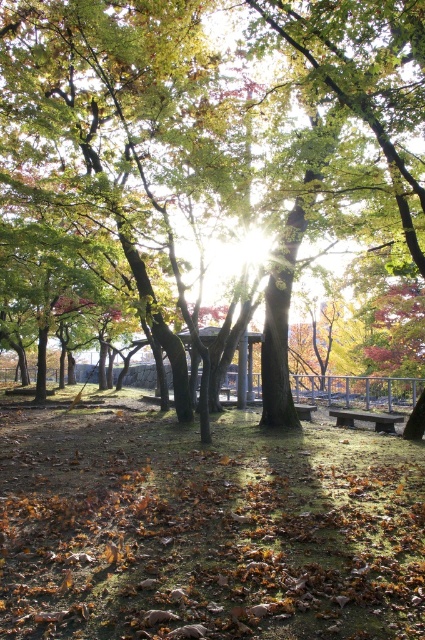
Question: Can you confirm if rustic wood bench at center is positioned to the right of wooden park bench at center?

Choices:
 (A) no
 (B) yes

Answer: (B)

Question: Which point is closer to the camera?

Choices:
 (A) (384, 422)
 (B) (302, 412)

Answer: (A)

Question: Is rustic wood bench at center further to camera compared to wooden park bench at center?

Choices:
 (A) yes
 (B) no

Answer: (A)

Question: Which point is closer to the camera taking this photo?

Choices:
 (A) (306, 404)
 (B) (339, 419)

Answer: (B)

Question: Observing the image, what is the correct spatial positioning of rustic wood bench at center in reference to wooden park bench at center?

Choices:
 (A) left
 (B) right

Answer: (B)

Question: Among these points, which one is farthest from the camera?

Choices:
 (A) (362, 412)
 (B) (306, 408)

Answer: (A)